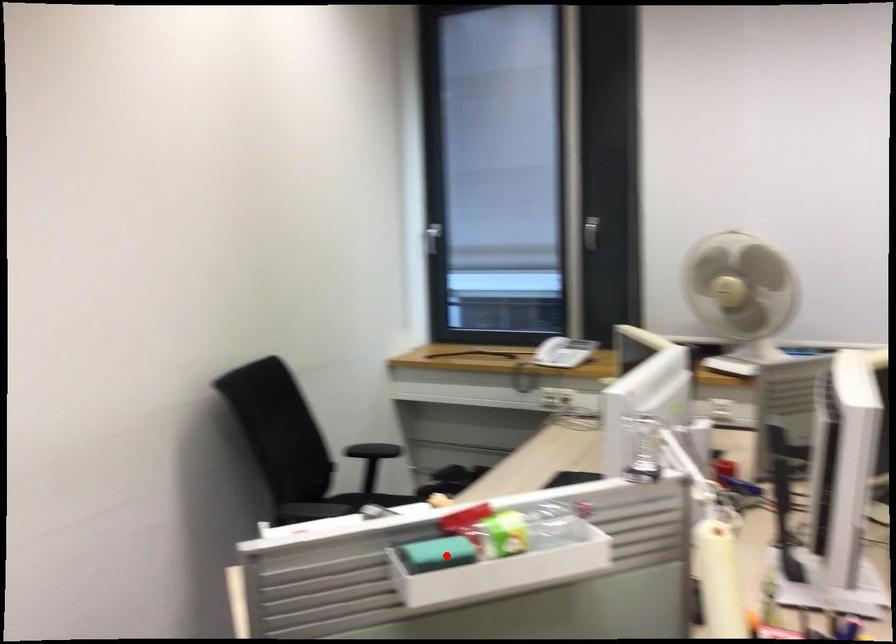
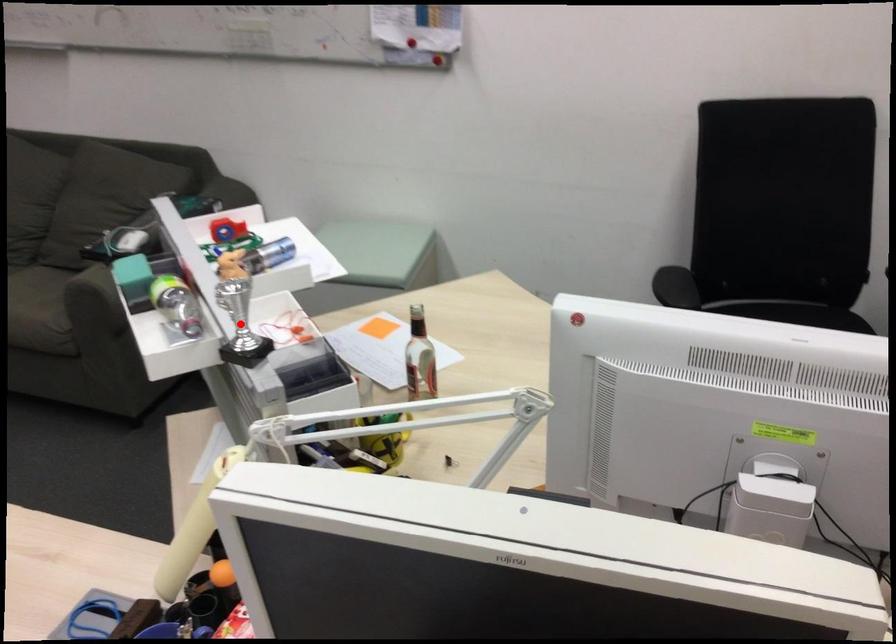
I am providing you with two images of the same scene from different viewpoints. A red point is marked on the first image and another point is marked on the second image. Is the red point in image1 aligned with the point shown in image2?

Yes